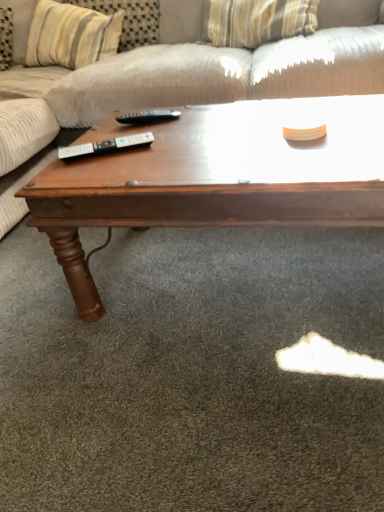
Describe the element at coordinates (71, 35) in the screenshot. The image size is (384, 512). I see `striped fabric pillow at upper center` at that location.

Where is `black plastic remote at center, the first remote in the top-to-bottom sequence`? black plastic remote at center, the first remote in the top-to-bottom sequence is located at coordinates (148, 116).

This screenshot has height=512, width=384. I want to click on textured beige fabric couch at upper center, so click(205, 65).

Find the location of `striped fabric pillow at upper center`. striped fabric pillow at upper center is located at coordinates (71, 35).

Is black plastic remote at center, the second remote when ordered from top to bottom, not close to black plastic remote at center, marked as the 2th remote in a bottom-to-top arrangement?

black plastic remote at center, the second remote when ordered from top to bottom, is actually quite close to black plastic remote at center, marked as the 2th remote in a bottom-to-top arrangement.

Is black plastic remote at center, the second remote when ordered from top to bottom, inside the boundaries of black plastic remote at center, the 2th remote when ordered from front to back, or outside?

black plastic remote at center, the second remote when ordered from top to bottom, is outside black plastic remote at center, the 2th remote when ordered from front to back.

At what (x,y) coordinates should I click in order to perform the action: click on remote above the black plastic remote at center, positioned as the 1th remote in front-to-back order (from the image's perspective). Please return your answer as a coordinate pair (x, y). Looking at the image, I should click on (148, 116).

From the image's perspective, between black plastic remote at center, which ranks as the second remote in back-to-front order, and black plastic remote at center, the 2th remote when ordered from front to back, which one is located above?

black plastic remote at center, the 2th remote when ordered from front to back, from the image's perspective.

Considering the positions of point (50, 29) and point (373, 67), is point (50, 29) closer or farther from the camera than point (373, 67)?

Point (50, 29) is positioned farther from the camera compared to point (373, 67).

Which of these two, striped fabric pillow at upper center or textured beige fabric couch at upper center, is bigger?

With larger size is textured beige fabric couch at upper center.

In the image, is striped fabric pillow at upper center positioned in front of or behind textured beige fabric couch at upper center?

striped fabric pillow at upper center is behind textured beige fabric couch at upper center.

Between striped fabric pillow at upper center and textured beige fabric couch at upper center, which one has larger width?

Wider between the two is textured beige fabric couch at upper center.

Consider the image. Is black plastic remote at center, the first remote in the top-to-bottom sequence, spatially inside black plastic remote at center, which ranks as the second remote in back-to-front order, or outside of it?

black plastic remote at center, the first remote in the top-to-bottom sequence, is spatially situated outside black plastic remote at center, which ranks as the second remote in back-to-front order.

Which object is further away from the camera, black plastic remote at center, the first remote in the top-to-bottom sequence, or black plastic remote at center, the second remote when ordered from top to bottom?

black plastic remote at center, the first remote in the top-to-bottom sequence, is more distant.

Can you confirm if black plastic remote at center, the 1th remote from the back, is positioned to the left of black plastic remote at center, which ranks as the second remote in back-to-front order?

In fact, black plastic remote at center, the 1th remote from the back, is to the right of black plastic remote at center, which ranks as the second remote in back-to-front order.

From a real-world perspective, is black plastic remote at center, the first remote in the top-to-bottom sequence, physically above black plastic remote at center, which ranks as the second remote in back-to-front order?

No, from a real-world perspective, black plastic remote at center, the first remote in the top-to-bottom sequence, is not on top of black plastic remote at center, which ranks as the second remote in back-to-front order.

Are textured beige fabric couch at upper center and striped fabric pillow at upper center located far from each other?

No, textured beige fabric couch at upper center is not far away from striped fabric pillow at upper center.

Can you confirm if textured beige fabric couch at upper center is bigger than striped fabric pillow at upper center?

Correct, textured beige fabric couch at upper center is larger in size than striped fabric pillow at upper center.

Which of these two, textured beige fabric couch at upper center or striped fabric pillow at upper center, stands shorter?

striped fabric pillow at upper center is shorter.

From the image's perspective, is textured beige fabric couch at upper center positioned above or below striped fabric pillow at upper center?

Clearly, from the image's perspective, textured beige fabric couch at upper center is below striped fabric pillow at upper center.

Who is shorter, black plastic remote at center, which ranks as the second remote in back-to-front order, or striped fabric pillow at upper center?

black plastic remote at center, which ranks as the second remote in back-to-front order.

What's the angular difference between black plastic remote at center, the second remote when ordered from top to bottom, and striped fabric pillow at upper center's facing directions?

There is a 63.2-degree angle between the facing directions of black plastic remote at center, the second remote when ordered from top to bottom, and striped fabric pillow at upper center.

Can we say black plastic remote at center, the second remote when ordered from top to bottom, lies outside striped fabric pillow at upper center?

Yes, black plastic remote at center, the second remote when ordered from top to bottom, is outside of striped fabric pillow at upper center.

Which is in front, black plastic remote at center, the second remote when ordered from top to bottom, or striped fabric pillow at upper center?

black plastic remote at center, the second remote when ordered from top to bottom, is in front.

The image size is (384, 512). What are the coordinates of `the 2nd remote below the textured beige fabric couch at upper center (from the image's perspective)` in the screenshot? It's located at (105, 146).

From the picture: Considering the sizes of textured beige fabric couch at upper center and black plastic remote at center, which is the 1th remote from bottom to top, in the image, is textured beige fabric couch at upper center taller or shorter than black plastic remote at center, which is the 1th remote from bottom to top,?

textured beige fabric couch at upper center is taller than black plastic remote at center, which is the 1th remote from bottom to top.

Is textured beige fabric couch at upper center beside black plastic remote at center, positioned as the 1th remote in front-to-back order?

They are not placed beside each other.

Is textured beige fabric couch at upper center behind black plastic remote at center, which ranks as the second remote in back-to-front order?

No, it is not.

Which is in front, black plastic remote at center, the first remote in the top-to-bottom sequence, or textured beige fabric couch at upper center?

textured beige fabric couch at upper center.

Consider the image. From the image's perspective, is black plastic remote at center, the 1th remote from the back, positioned above or below textured beige fabric couch at upper center?

Based on their image positions, black plastic remote at center, the 1th remote from the back, is located beneath textured beige fabric couch at upper center.

Do you think black plastic remote at center, marked as the 2th remote in a bottom-to-top arrangement, is within textured beige fabric couch at upper center, or outside of it?

black plastic remote at center, marked as the 2th remote in a bottom-to-top arrangement, can be found inside textured beige fabric couch at upper center.

Could you tell me if black plastic remote at center, the 2th remote when ordered from front to back, is facing textured beige fabric couch at upper center?

Yes, black plastic remote at center, the 2th remote when ordered from front to back, is facing textured beige fabric couch at upper center.

I want to click on remote that is below the black plastic remote at center, the first remote in the top-to-bottom sequence (from the image's perspective), so click(x=105, y=146).

In order to click on pillow located on the left of textured beige fabric couch at upper center in this screenshot , I will do `click(71, 35)`.

Estimate the real-world distances between objects in this image. Which object is further from striped fabric pillow at upper center, black plastic remote at center, which ranks as the second remote in back-to-front order, or black plastic remote at center, the 2th remote when ordered from front to back?

black plastic remote at center, which ranks as the second remote in back-to-front order, lies further to striped fabric pillow at upper center than the other object.

Estimate the real-world distances between objects in this image. Which object is further from black plastic remote at center, which is the 1th remote from bottom to top, textured beige fabric couch at upper center or black plastic remote at center, the 1th remote from the back?

The object further to black plastic remote at center, which is the 1th remote from bottom to top, is textured beige fabric couch at upper center.

Which object lies nearer to the anchor point striped fabric pillow at upper center, textured beige fabric couch at upper center or dark wood coffee table at center?

textured beige fabric couch at upper center lies closer to striped fabric pillow at upper center than the other object.

Which object lies further to the anchor point black plastic remote at center, marked as the 2th remote in a bottom-to-top arrangement, dark wood coffee table at center or striped fabric pillow at upper center?

Based on the image, striped fabric pillow at upper center appears to be further to black plastic remote at center, marked as the 2th remote in a bottom-to-top arrangement.

Which object lies nearer to the anchor point striped fabric pillow at upper center, dark wood coffee table at center or black plastic remote at center, the second remote when ordered from top to bottom?

Based on the image, dark wood coffee table at center appears to be nearer to striped fabric pillow at upper center.

Which object lies further to the anchor point striped fabric pillow at upper center, black plastic remote at center, the 2th remote when ordered from front to back, or black plastic remote at center, the second remote when ordered from top to bottom?

Based on the image, black plastic remote at center, the second remote when ordered from top to bottom, appears to be further to striped fabric pillow at upper center.

Considering their positions, is textured beige fabric couch at upper center positioned closer to black plastic remote at center, positioned as the 1th remote in front-to-back order, than dark wood coffee table at center?

dark wood coffee table at center.

When comparing their distances from dark wood coffee table at center, does textured beige fabric couch at upper center or striped fabric pillow at upper center seem further?

Among the two, striped fabric pillow at upper center is located further to dark wood coffee table at center.

The image size is (384, 512). I want to click on coffee table located between textured beige fabric couch at upper center and black plastic remote at center, marked as the 2th remote in a bottom-to-top arrangement, in the depth direction, so click(215, 177).

Identify the location of coffee table between textured beige fabric couch at upper center and striped fabric pillow at upper center in the front-back direction. This screenshot has width=384, height=512. (215, 177).

The image size is (384, 512). Find the location of `remote between dark wood coffee table at center and black plastic remote at center, the 1th remote from the back, in the front-back direction`. remote between dark wood coffee table at center and black plastic remote at center, the 1th remote from the back, in the front-back direction is located at coordinates (105, 146).

Locate an element on the screen. This screenshot has height=512, width=384. remote between striped fabric pillow at upper center and black plastic remote at center, which ranks as the second remote in back-to-front order, in the up-down direction is located at coordinates (148, 116).